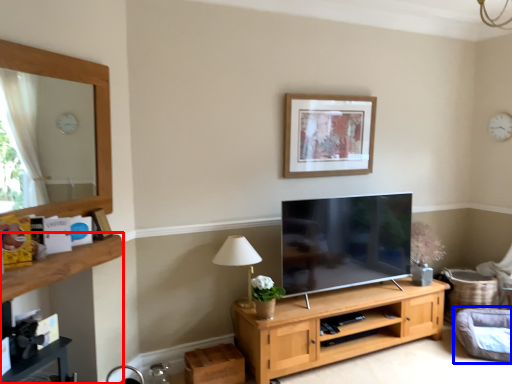
Question: Among these objects, which one is farthest to the camera, dresser (highlighted by a red box) or swivel chair (highlighted by a blue box)?

Choices:
 (A) dresser
 (B) swivel chair

Answer: (B)